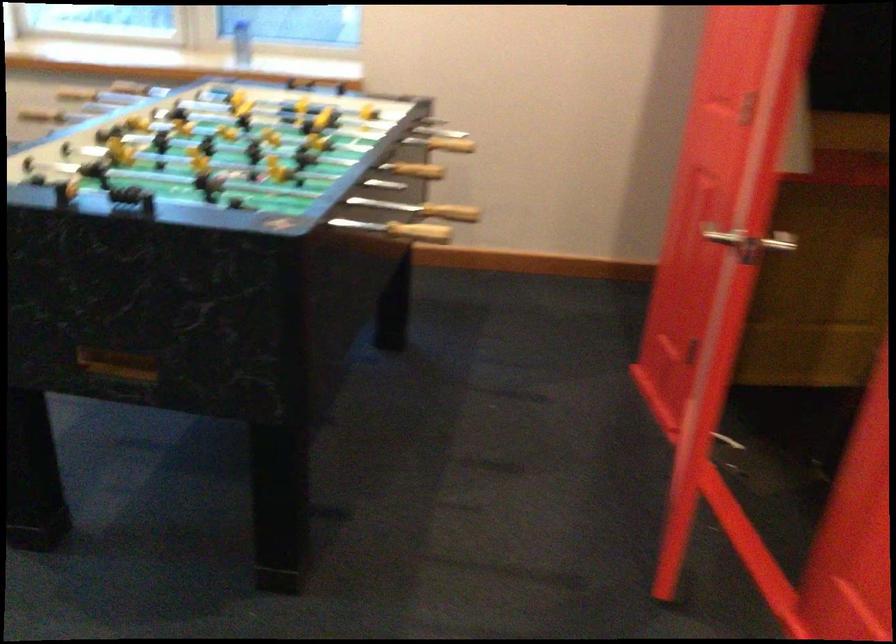
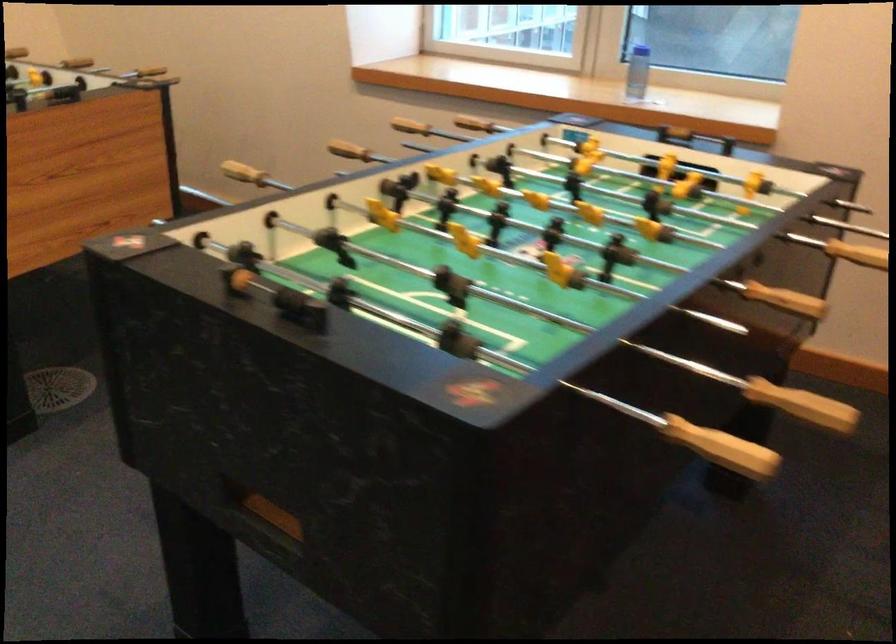
The point at (316, 104) is marked in the first image. Where is the corresponding point in the second image?

(678, 172)